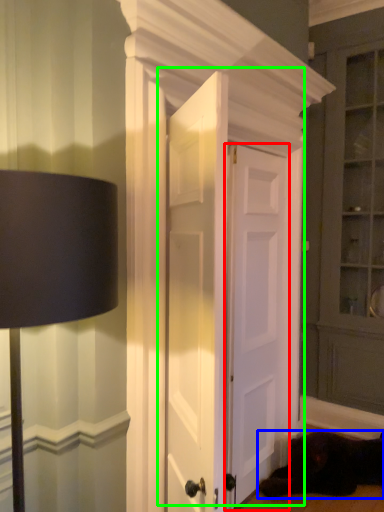
Question: Which is farther away from door (highlighted by a red box)? dog (highlighted by a blue box) or door (highlighted by a green box)?

Choices:
 (A) dog
 (B) door

Answer: (A)